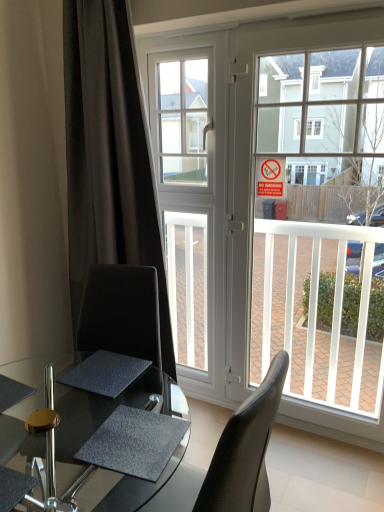
Question: Is dark matte curtain at left oriented towards white glass window at center?

Choices:
 (A) no
 (B) yes

Answer: (B)

Question: From a real-world perspective, is dark matte curtain at left physically above white glass window at center?

Choices:
 (A) no
 (B) yes

Answer: (A)

Question: From the image's perspective, is dark matte curtain at left beneath white glass window at center?

Choices:
 (A) no
 (B) yes

Answer: (B)

Question: Can you confirm if dark matte curtain at left is bigger than white glass window at center?

Choices:
 (A) yes
 (B) no

Answer: (A)

Question: Does dark matte curtain at left have a smaller size compared to white glass window at center?

Choices:
 (A) no
 (B) yes

Answer: (A)

Question: From a real-world perspective, is dark matte curtain at left physically below white glass window at center?

Choices:
 (A) yes
 (B) no

Answer: (A)

Question: Is white glass window at center completely or partially inside clear glass door at center?

Choices:
 (A) yes
 (B) no

Answer: (B)

Question: Does clear glass door at center appear on the right side of white glass window at center?

Choices:
 (A) no
 (B) yes

Answer: (B)

Question: From the image's perspective, would you say clear glass door at center is positioned over white glass window at center?

Choices:
 (A) yes
 (B) no

Answer: (B)

Question: Is clear glass door at center aimed at white glass window at center?

Choices:
 (A) no
 (B) yes

Answer: (A)

Question: Considering the relative sizes of clear glass door at center and white glass window at center in the image provided, is clear glass door at center smaller than white glass window at center?

Choices:
 (A) yes
 (B) no

Answer: (B)

Question: Is clear glass door at center wider than white glass window at center?

Choices:
 (A) no
 (B) yes

Answer: (B)

Question: From the image's perspective, is white glass window at center beneath dark matte curtain at left?

Choices:
 (A) no
 (B) yes

Answer: (A)